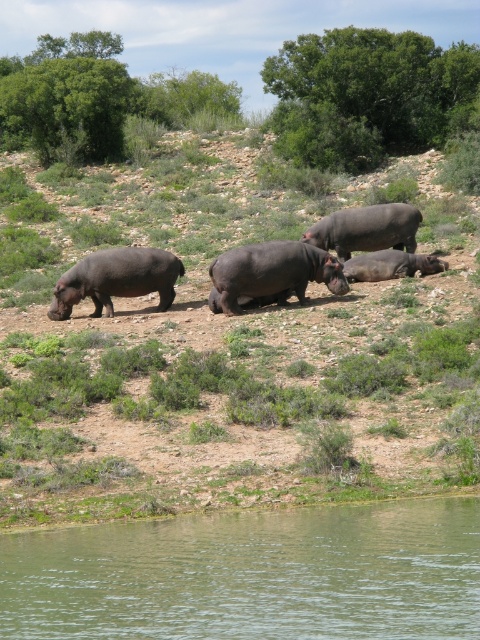
Does greenish water at lower left appear under dark gray matte hippo at center?

Correct, greenish water at lower left is located below dark gray matte hippo at center.

Between greenish water at lower left and dark gray matte hippo at center, which one is positioned lower?

greenish water at lower left is lower down.

What do you see at coordinates (252, 576) in the screenshot? I see `greenish water at lower left` at bounding box center [252, 576].

Locate an element on the screen. This screenshot has height=640, width=480. greenish water at lower left is located at coordinates (252, 576).

Is point (336, 241) positioned in front of point (396, 269)?

No, it is not.

Is smooth dark gray hippo at center shorter than dark gray matte hippo at center?

No.

Where is `smooth dark gray hippo at center`? The image size is (480, 640). smooth dark gray hippo at center is located at coordinates (365, 228).

You are a GUI agent. You are given a task and a screenshot of the screen. Output one action in this format:
    pyautogui.click(x=<x>, y=<y>)
    Task: Click on the smooth dark gray hippo at center
    The height and width of the screenshot is (640, 480).
    Given the screenshot: What is the action you would take?
    pyautogui.click(x=365, y=228)

Which is behind, point (445, 499) or point (76, 276)?

The point (76, 276) is behind.

Which is in front, point (412, 516) or point (60, 278)?

Point (412, 516)

Measure the distance between point (162, 573) and camera.

Point (162, 573) and camera are 12.93 meters apart.

In order to click on greenish water at lower left in this screenshot , I will do `click(252, 576)`.